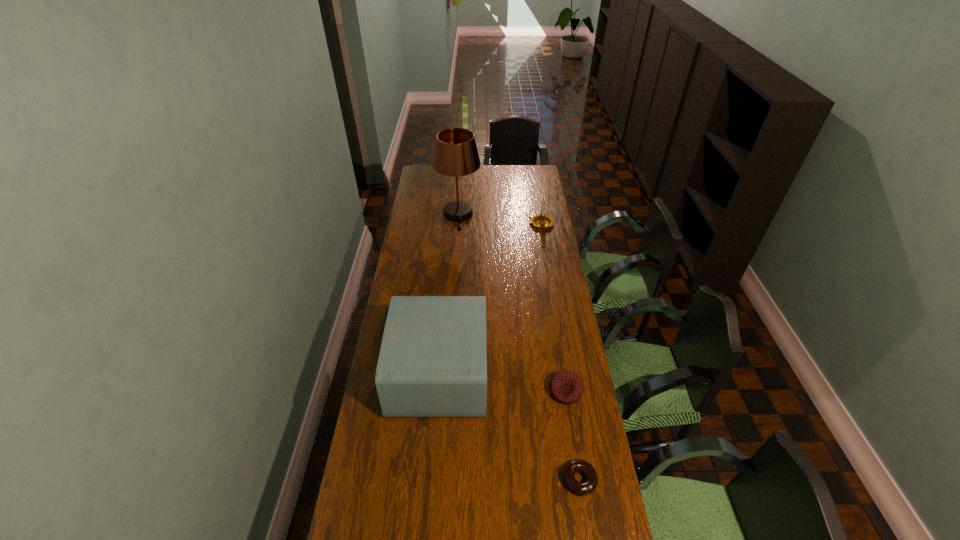
You are a GUI agent. You are given a task and a screenshot of the screen. Output one action in this format:
    pyautogui.click(x=<x>, y=<y>)
    Task: Click on the free space that satisfies the following two spatial constraints: 1. on the front-facing side of the lampshade; 2. on the front panel of the radio receiver
    The image size is (960, 540).
    Given the screenshot: What is the action you would take?
    pyautogui.click(x=448, y=372)

This screenshot has height=540, width=960. Find the location of `free point that satisfies the following two spatial constraints: 1. on the front-facing side of the lampshade; 2. on the front panel of the second tallest object`. free point that satisfies the following two spatial constraints: 1. on the front-facing side of the lampshade; 2. on the front panel of the second tallest object is located at coordinates (448, 372).